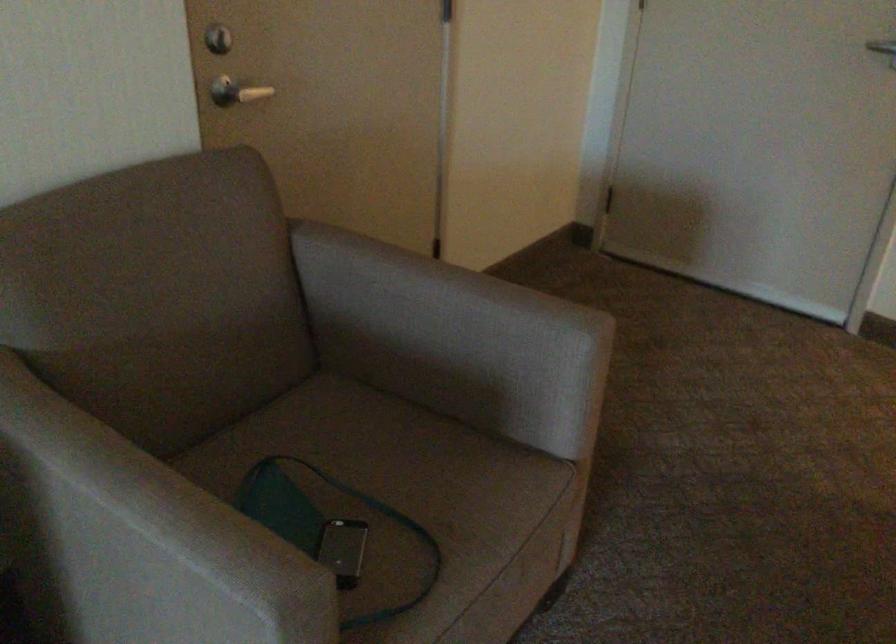
What do you see at coordinates (882, 46) in the screenshot? I see `a silver door handle` at bounding box center [882, 46].